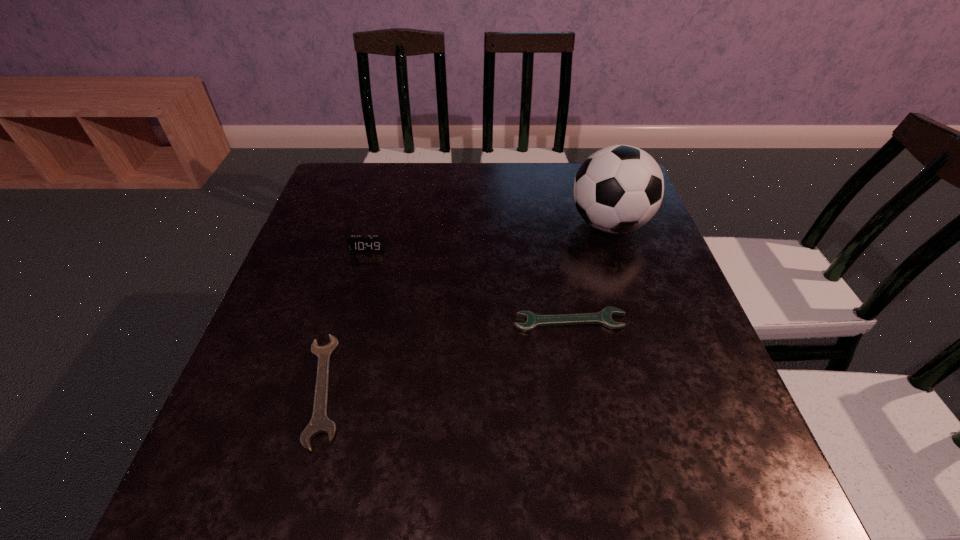
Where is `object that is the third closest one to the left wrench`? This screenshot has width=960, height=540. object that is the third closest one to the left wrench is located at coordinates (618, 189).

Locate an element on the screen. This screenshot has width=960, height=540. object that is the second closest to the tallest object is located at coordinates (356, 243).

The image size is (960, 540). I want to click on blank area in the image that satisfies the following two spatial constraints: 1. on the front-facing side of the farther wrench; 2. on the right side of the second tallest object, so click(x=348, y=321).

Image resolution: width=960 pixels, height=540 pixels. In order to click on free space that satisfies the following two spatial constraints: 1. on the front-facing side of the alarm clock; 2. on the right side of the right wrench in this screenshot , I will do `click(348, 321)`.